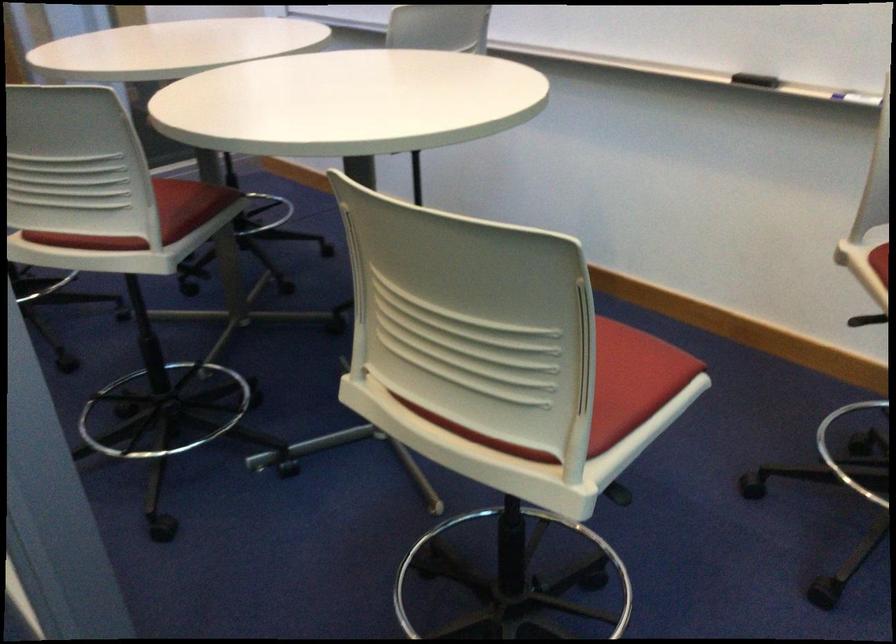
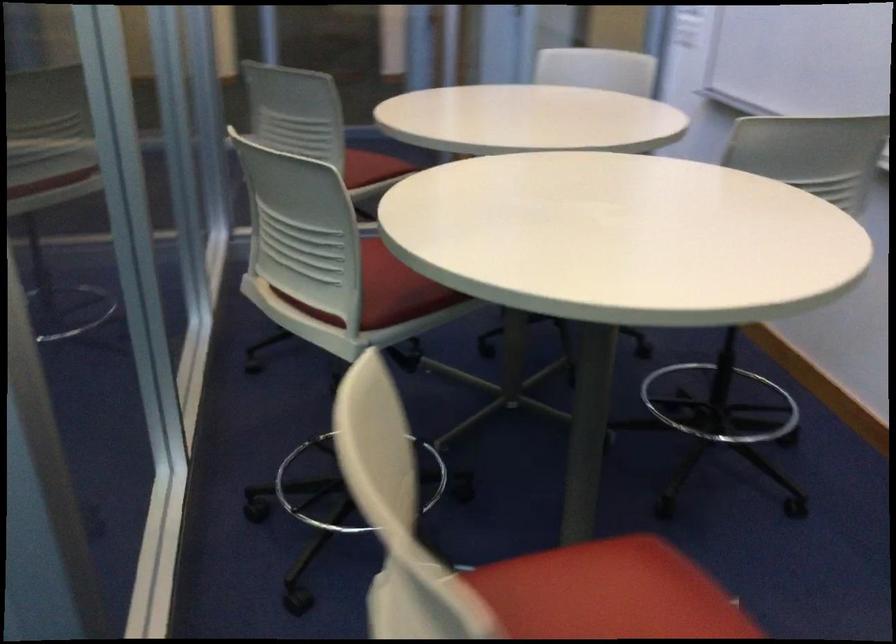
Locate, in the second image, the point that corresponds to point (426, 214) in the first image.

(348, 487)